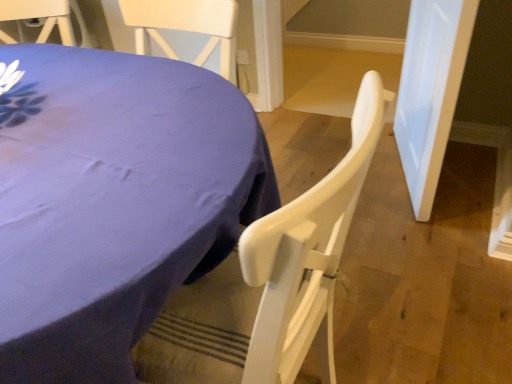
The width and height of the screenshot is (512, 384). In order to click on matte blue tablecloth at center in this screenshot , I will do `click(113, 201)`.

The width and height of the screenshot is (512, 384). Describe the element at coordinates (113, 201) in the screenshot. I see `matte blue tablecloth at center` at that location.

What are the coordinates of `matte blue tablecloth at center` in the screenshot? It's located at (113, 201).